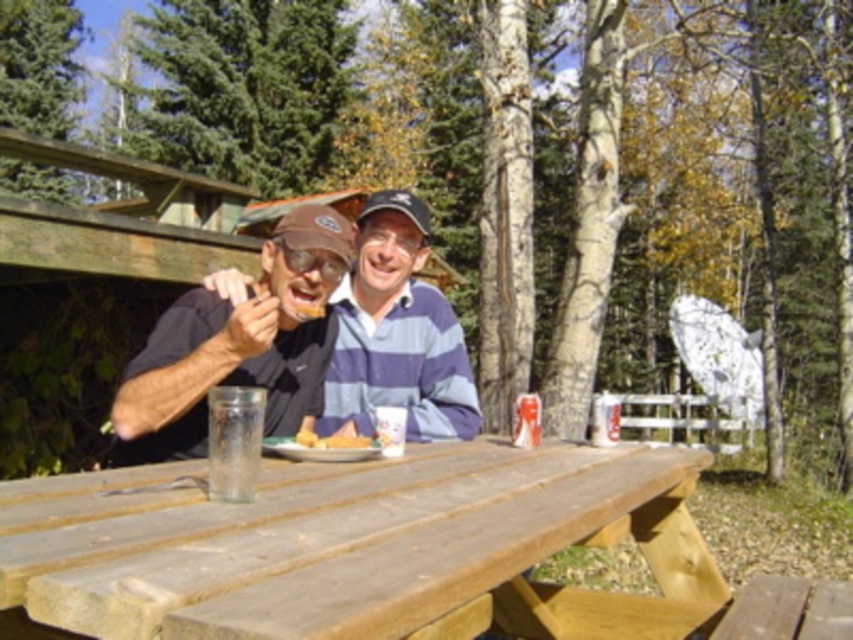
How much distance is there between wooden picnic table at center and blue striped shirt at center?

wooden picnic table at center and blue striped shirt at center are 30.15 inches apart from each other.

Can you confirm if wooden picnic table at center is positioned to the right of blue striped shirt at center?

Indeed, wooden picnic table at center is positioned on the right side of blue striped shirt at center.

Identify the location of wooden picnic table at center. Image resolution: width=853 pixels, height=640 pixels. (358, 547).

Is wooden picnic table at center closer to the viewer compared to golden fried chicken at center?

Yes, it is.

Is point (351, 547) positioned before point (329, 436)?

That is True.

Between point (15, 554) and point (334, 444), which one is positioned behind?

The point (334, 444) is more distant.

Where is `wooden picnic table at center`? wooden picnic table at center is located at coordinates 358,547.

Which is behind, point (428, 323) or point (320, 436)?

The point (428, 323) is more distant.

Is matte black shirt at center below golden fried chicken at center?

Incorrect, matte black shirt at center is not positioned below golden fried chicken at center.

Locate an element on the screen. This screenshot has width=853, height=640. matte black shirt at center is located at coordinates (321, 346).